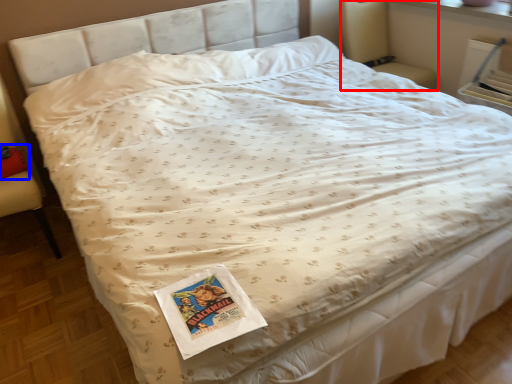
Question: Which object is closer to the camera taking this photo, armchair (highlighted by a red box) or pillow (highlighted by a blue box)?

Choices:
 (A) armchair
 (B) pillow

Answer: (B)